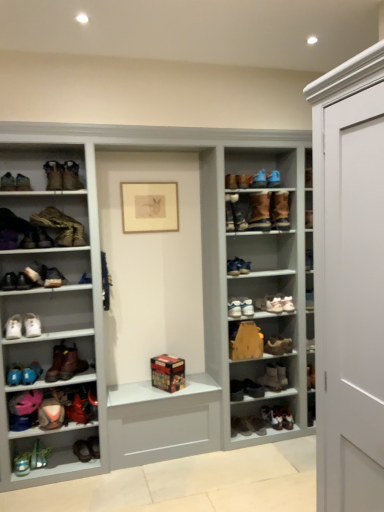
Question: From the image's perspective, is shiny black sneakers at lower center, which ranks as the 4th footwear in bottom-to-top order, below brown leather boot at lower left, acting as the 11th footwear starting from the top?

Choices:
 (A) no
 (B) yes

Answer: (B)

Question: Is shiny black sneakers at lower center, which ranks as the 4th footwear in bottom-to-top order, outside of brown leather boot at lower left, placed as the tenth footwear when sorted from bottom to top?

Choices:
 (A) no
 (B) yes

Answer: (B)

Question: Is shiny black sneakers at lower center, which ranks as the 4th footwear in bottom-to-top order, bigger than brown leather boot at lower left, placed as the tenth footwear when sorted from bottom to top?

Choices:
 (A) yes
 (B) no

Answer: (B)

Question: Considering the relative positions of shiny black sneakers at lower center, which appears as the seventeenth footwear when viewed from the top, and brown leather boot at lower left, placed as the tenth footwear when sorted from bottom to top, in the image provided, is shiny black sneakers at lower center, which appears as the seventeenth footwear when viewed from the top, to the left of brown leather boot at lower left, placed as the tenth footwear when sorted from bottom to top, from the viewer's perspective?

Choices:
 (A) no
 (B) yes

Answer: (A)

Question: Does shiny black sneakers at lower center, which ranks as the 4th footwear in bottom-to-top order, have a lesser width compared to brown leather boot at lower left, placed as the tenth footwear when sorted from bottom to top?

Choices:
 (A) no
 (B) yes

Answer: (B)

Question: Can you confirm if shiny black sneakers at lower center, which ranks as the 4th footwear in bottom-to-top order, is positioned to the right of brown leather boot at lower left, acting as the 11th footwear starting from the top?

Choices:
 (A) no
 (B) yes

Answer: (B)

Question: Is brown suede boot at upper center, which is the eighth shoe in bottom-to-top order, directly adjacent to brown leather boot at lower left, the twelfth footwear when ordered from top to bottom?

Choices:
 (A) yes
 (B) no

Answer: (B)

Question: Is brown suede boot at upper center, positioned as the 4th shoe in left-to-right order, bigger than brown leather boot at lower left, acting as the ninth footwear starting from the bottom?

Choices:
 (A) no
 (B) yes

Answer: (A)

Question: Can you confirm if brown suede boot at upper center, which is the eighth shoe in bottom-to-top order, is positioned to the left of brown leather boot at lower left, acting as the ninth footwear starting from the bottom?

Choices:
 (A) no
 (B) yes

Answer: (A)

Question: Is brown suede boot at upper center, positioned as the 4th shoe in left-to-right order, closer to the viewer compared to brown leather boot at lower left, acting as the ninth footwear starting from the bottom?

Choices:
 (A) yes
 (B) no

Answer: (B)

Question: Could brown leather boot at lower left, the twelfth footwear when ordered from top to bottom, be considered to be inside brown suede boot at upper center, the 6th shoe viewed from the right?

Choices:
 (A) no
 (B) yes

Answer: (A)

Question: Considering the relative sizes of brown suede boot at upper center, the 6th shoe viewed from the right, and brown leather boot at lower left, the twelfth footwear when ordered from top to bottom, in the image provided, is brown suede boot at upper center, the 6th shoe viewed from the right, thinner than brown leather boot at lower left, the twelfth footwear when ordered from top to bottom,?

Choices:
 (A) yes
 (B) no

Answer: (A)

Question: From the image's perspective, is shiny black sneakers at lower center, which ranks as the 4th footwear in bottom-to-top order, located beneath white leather sneakers at center, arranged as the ninth shoe when viewed from the left?

Choices:
 (A) no
 (B) yes

Answer: (B)